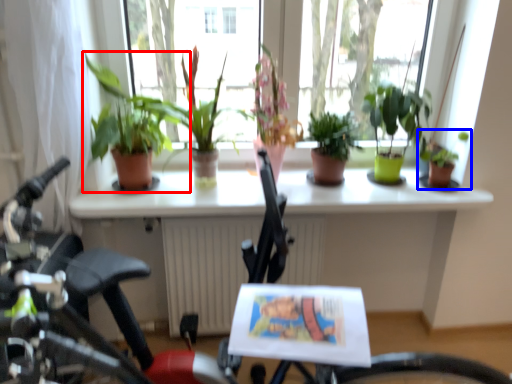
Question: Which object is closer to the camera taking this photo, houseplant (highlighted by a red box) or houseplant (highlighted by a blue box)?

Choices:
 (A) houseplant
 (B) houseplant

Answer: (A)